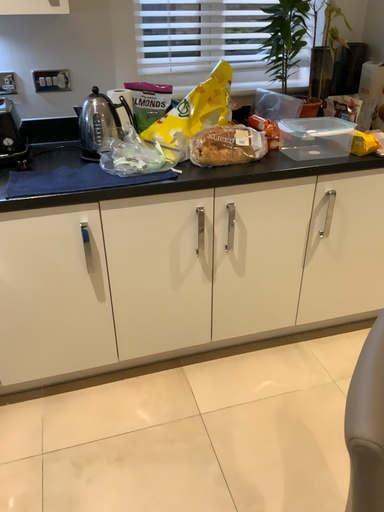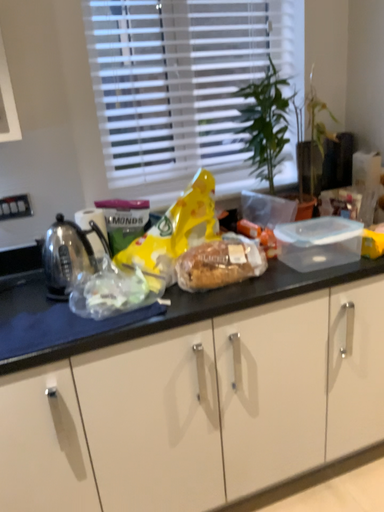
Question: Which way did the camera rotate in the video?

Choices:
 (A) rotated downward
 (B) rotated upward

Answer: (B)